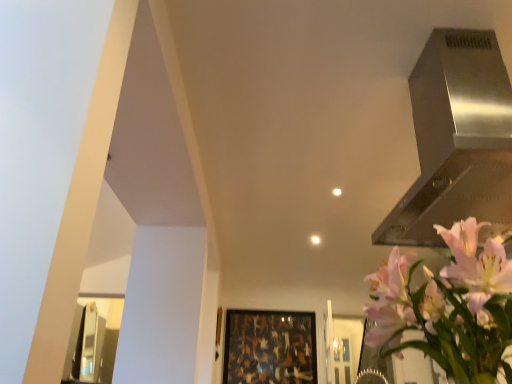
At what (x,y) coordinates should I click in order to perform the action: click on wooden frame at center. Please return your answer as a coordinate pair (x, y). The width and height of the screenshot is (512, 384). Looking at the image, I should click on (270, 347).

What do you see at coordinates (456, 140) in the screenshot? I see `stainless steel vent at upper right` at bounding box center [456, 140].

Where is `wooden frame at center`? wooden frame at center is located at coordinates (270, 347).

From a real-world perspective, is wooden frame at center positioned above or below stainless steel vent at upper right?

Clearly, from a real-world perspective, wooden frame at center is below stainless steel vent at upper right.

Considering the relative positions of wooden frame at center and stainless steel vent at upper right in the image provided, is wooden frame at center to the left of stainless steel vent at upper right from the viewer's perspective?

Indeed, wooden frame at center is positioned on the left side of stainless steel vent at upper right.

Between wooden frame at center and stainless steel vent at upper right, which one is positioned in front?

stainless steel vent at upper right.

Is point (284, 338) farther from camera compared to point (490, 31)?

Yes, point (284, 338) is behind point (490, 31).

Which is correct: stainless steel vent at upper right is inside pink matte flower at upper right, or outside of it?

stainless steel vent at upper right cannot be found inside pink matte flower at upper right.

Does stainless steel vent at upper right have a greater height compared to pink matte flower at upper right?

Yes, stainless steel vent at upper right is taller than pink matte flower at upper right.

Is stainless steel vent at upper right facing towards pink matte flower at upper right?

No, stainless steel vent at upper right is not oriented towards pink matte flower at upper right.

Based on the photo, is stainless steel vent at upper right smaller than pink matte flower at upper right?

Incorrect, stainless steel vent at upper right is not smaller in size than pink matte flower at upper right.

Does wooden frame at center contain pink matte flower at upper right?

No, pink matte flower at upper right is not surrounded by wooden frame at center.

Where is `picture frame behind the pink matte flower at upper right`? The image size is (512, 384). picture frame behind the pink matte flower at upper right is located at coordinates (270, 347).

Which object is closer to the camera, wooden frame at center or pink matte flower at upper right?

pink matte flower at upper right is in front.

Is wooden frame at center wider than pink matte flower at upper right?

No, wooden frame at center is not wider than pink matte flower at upper right.

Is pink matte flower at upper right at the right side of wooden frame at center?

Correct, you'll find pink matte flower at upper right to the right of wooden frame at center.

The height and width of the screenshot is (384, 512). I want to click on flower above the wooden frame at center (from the image's perspective), so click(x=476, y=263).

From a real-world perspective, is pink matte flower at upper right physically located above or below wooden frame at center?

pink matte flower at upper right is below wooden frame at center.

Is stainless steel vent at upper right positioned with its back to wooden frame at center?

stainless steel vent at upper right does not have its back to wooden frame at center.

Is stainless steel vent at upper right positioned far away from wooden frame at center?

Yes, stainless steel vent at upper right and wooden frame at center are quite far apart.

Is stainless steel vent at upper right located outside wooden frame at center?

stainless steel vent at upper right is positioned outside wooden frame at center.

Does point (426, 69) come closer to viewer compared to point (234, 322)?

That is True.

Is pink matte flower at upper right facing away from stainless steel vent at upper right?

No, pink matte flower at upper right's orientation is not away from stainless steel vent at upper right.

Would you say pink matte flower at upper right is inside or outside stainless steel vent at upper right?

pink matte flower at upper right is not inside stainless steel vent at upper right, it's outside.

Where is `flower that appears below the stainless steel vent at upper right (from the image's perspective)`? The image size is (512, 384). flower that appears below the stainless steel vent at upper right (from the image's perspective) is located at coordinates (476, 263).

Does pink matte flower at upper right have a lesser height compared to stainless steel vent at upper right?

Yes.

Image resolution: width=512 pixels, height=384 pixels. In order to click on vent on the right of the wooden frame at center in this screenshot , I will do `click(456, 140)`.

Locate an element on the screen. The image size is (512, 384). flower lying below the stainless steel vent at upper right (from the image's perspective) is located at coordinates (476, 263).

Which object lies further to the anchor point pink matte flower at upper right, stainless steel vent at upper right or wooden frame at center?

wooden frame at center lies further to pink matte flower at upper right than the other object.

Estimate the real-world distances between objects in this image. Which object is further from wooden frame at center, stainless steel vent at upper right or pink matte flower at upper right?

pink matte flower at upper right is positioned further to the anchor wooden frame at center.

Which object lies further to the anchor point wooden frame at center, pink matte flower at upper right or stainless steel vent at upper right?

pink matte flower at upper right is positioned further to the anchor wooden frame at center.

When comparing their distances from pink matte flower at upper right, does wooden frame at center or stainless steel vent at upper right seem closer?

stainless steel vent at upper right is positioned closer to the anchor pink matte flower at upper right.

Considering their positions, is wooden frame at center positioned closer to stainless steel vent at upper right than pink matte flower at upper right?

Based on the image, pink matte flower at upper right appears to be nearer to stainless steel vent at upper right.

Considering their positions, is pink matte flower at upper right positioned closer to stainless steel vent at upper right than wooden frame at center?

pink matte flower at upper right is closer to stainless steel vent at upper right.

Image resolution: width=512 pixels, height=384 pixels. I want to click on vent located between pink matte flower at upper right and wooden frame at center in the depth direction, so click(456, 140).